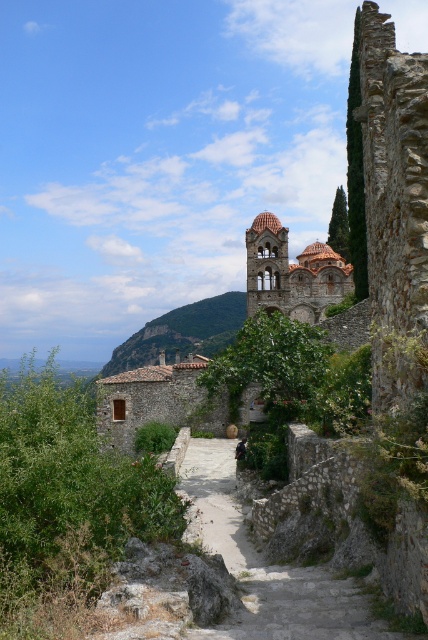
You are standing at the base of the hill looking up at the historic stone structure. Which object, the brown stone tower at center or the green stone wall at center, would appear larger to you?

The brown stone tower at center would appear larger because it is closer to the viewer than the green stone wall at center.